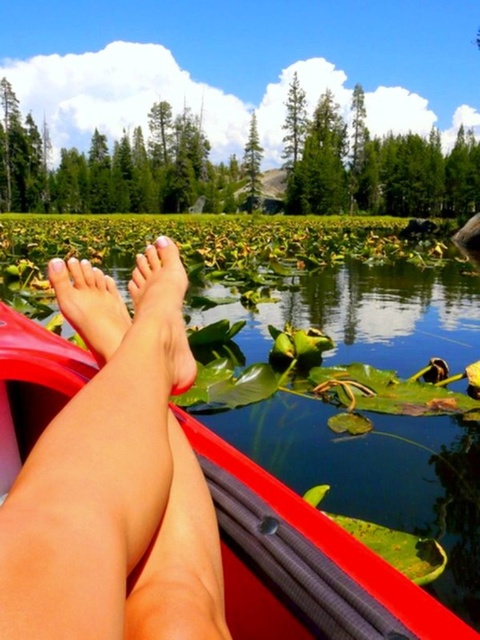
Is rubberized red kayak at lower left closer to camera compared to pink matte feet at lower center?

Yes, rubberized red kayak at lower left is in front of pink matte feet at lower center.

Identify the location of rubberized red kayak at lower left. (142, 493).

Can you confirm if skinny legs at center is bigger than smooth skin foot at center?

Yes, skinny legs at center is bigger than smooth skin foot at center.

Is skinny legs at center wider than smooth skin foot at center?

Yes.

Is point (81, 548) closer to viewer compared to point (171, 276)?

Yes, it is in front of point (171, 276).

Locate an element on the screen. The height and width of the screenshot is (640, 480). skinny legs at center is located at coordinates (116, 480).

Is rubberized red kayak at lower left in front of smooth skin foot at center?

Yes, rubberized red kayak at lower left is closer to the viewer.

Which is in front, point (180, 285) or point (170, 250)?

Point (180, 285)

Is point (345, 568) farther from viewer compared to point (154, 296)?

No, (345, 568) is closer to viewer.

You are a GUI agent. You are given a task and a screenshot of the screen. Output one action in this format:
    pyautogui.click(x=<x>, y=<y>)
    Task: Click on the rubberized red kayak at lower left
    The width and height of the screenshot is (480, 640).
    Given the screenshot: What is the action you would take?
    pyautogui.click(x=142, y=493)